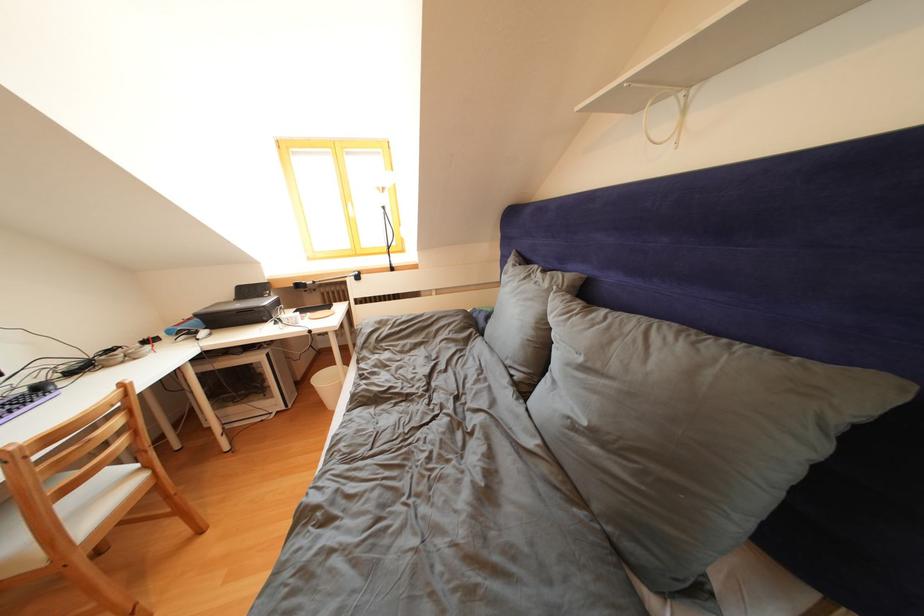
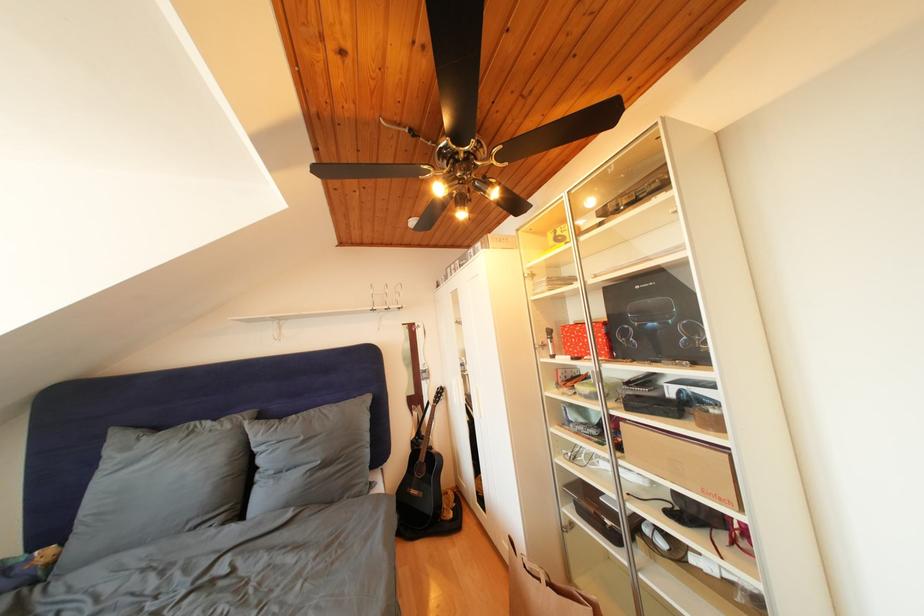
Find the pixel in the second image that matches (590,363) in the first image.

(310, 444)